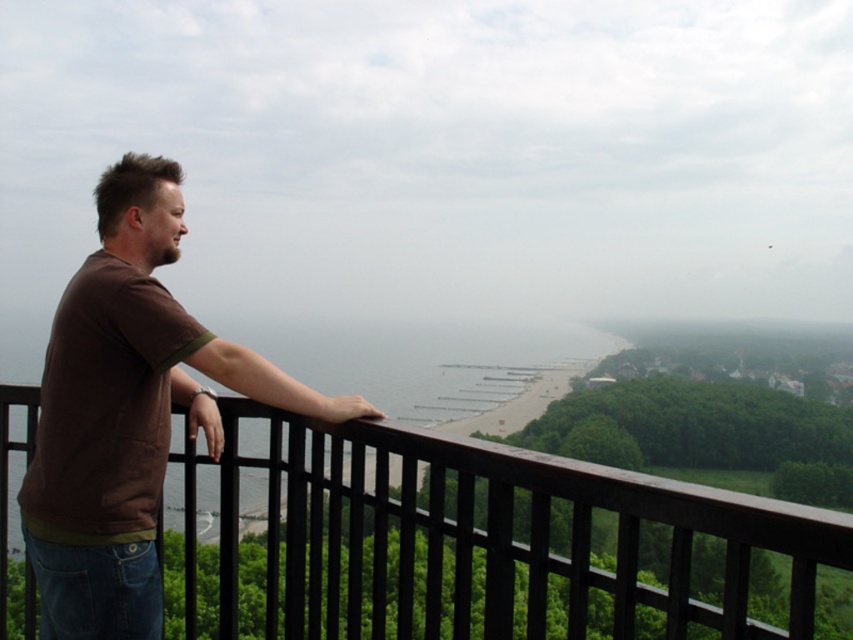
Question: Which of the following is the closest to the observer?

Choices:
 (A) brown wood/rail at center
 (B) brown cotton t-shirt at left

Answer: (A)

Question: Among these points, which one is nearest to the camera?

Choices:
 (A) (397, 436)
 (B) (120, 168)

Answer: (A)

Question: In this image, where is brown wood/rail at center located relative to brown cotton t-shirt at left?

Choices:
 (A) below
 (B) above

Answer: (A)

Question: Is brown wood/rail at center positioned behind brown cotton t-shirt at left?

Choices:
 (A) yes
 (B) no

Answer: (B)

Question: Is brown wood/rail at center bigger than brown cotton t-shirt at left?

Choices:
 (A) yes
 (B) no

Answer: (A)